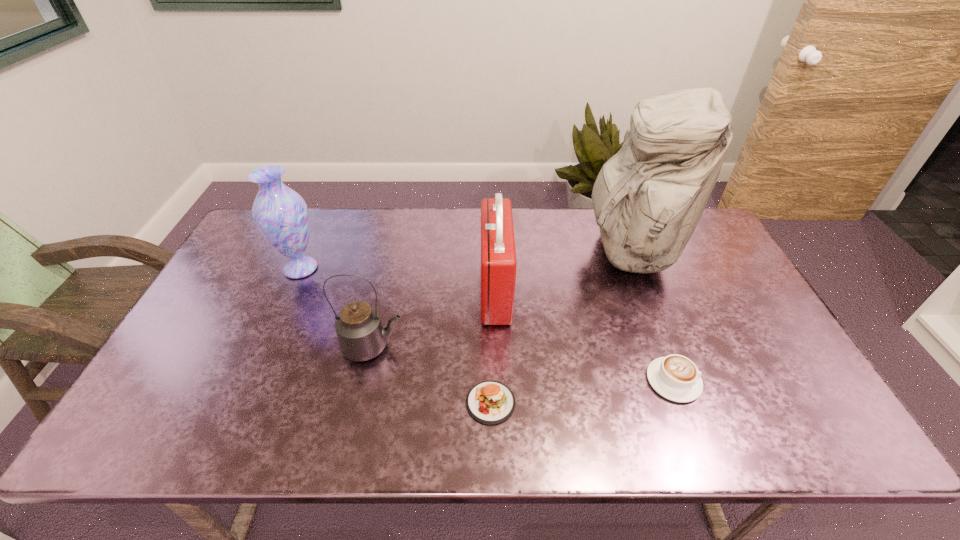
The height and width of the screenshot is (540, 960). In order to click on vacant area situated on the right of the vase in this screenshot , I will do `click(445, 268)`.

Locate an element on the screen. The width and height of the screenshot is (960, 540). blank space located on the front face of the first-aid kit is located at coordinates (417, 291).

The width and height of the screenshot is (960, 540). I want to click on free space located 0.380m on the front face of the first-aid kit, so click(x=352, y=291).

At what (x,y) coordinates should I click in order to perform the action: click on vacant space situated on the front face of the first-aid kit. Please return your answer as a coordinate pair (x, y). This screenshot has height=540, width=960. Looking at the image, I should click on (349, 291).

You are a GUI agent. You are given a task and a screenshot of the screen. Output one action in this format:
    pyautogui.click(x=<x>, y=<y>)
    Task: Click on the vacant space located spout on the fourth tallest object
    This screenshot has height=540, width=960.
    Given the screenshot: What is the action you would take?
    pyautogui.click(x=460, y=347)

Where is `vacant space located with the handle on the right side of the second shortest object`? This screenshot has width=960, height=540. vacant space located with the handle on the right side of the second shortest object is located at coordinates (803, 381).

You are a GUI agent. You are given a task and a screenshot of the screen. Output one action in this format:
    pyautogui.click(x=<x>, y=<y>)
    Task: Click on the vacant space located on the back of the shortest object
    The height and width of the screenshot is (540, 960).
    Given the screenshot: What is the action you would take?
    pyautogui.click(x=489, y=315)

In order to click on object situated at the far edge in this screenshot , I will do `click(648, 198)`.

Image resolution: width=960 pixels, height=540 pixels. I want to click on object that is at the near edge, so click(x=490, y=402).

You are a GUI agent. You are given a task and a screenshot of the screen. Output one action in this format:
    pyautogui.click(x=<x>, y=<y>)
    Task: Click on the object located in the left edge section of the desktop
    The width and height of the screenshot is (960, 540).
    Given the screenshot: What is the action you would take?
    pyautogui.click(x=281, y=214)